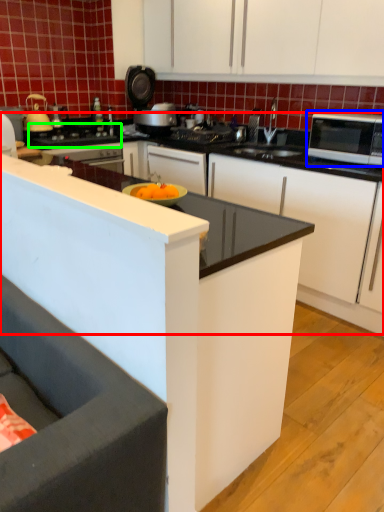
Question: Which object is positioned closest to counter (highlighted by a red box)? Select from microwave oven (highlighted by a blue box) and gas stove (highlighted by a green box).

Choices:
 (A) microwave oven
 (B) gas stove

Answer: (A)